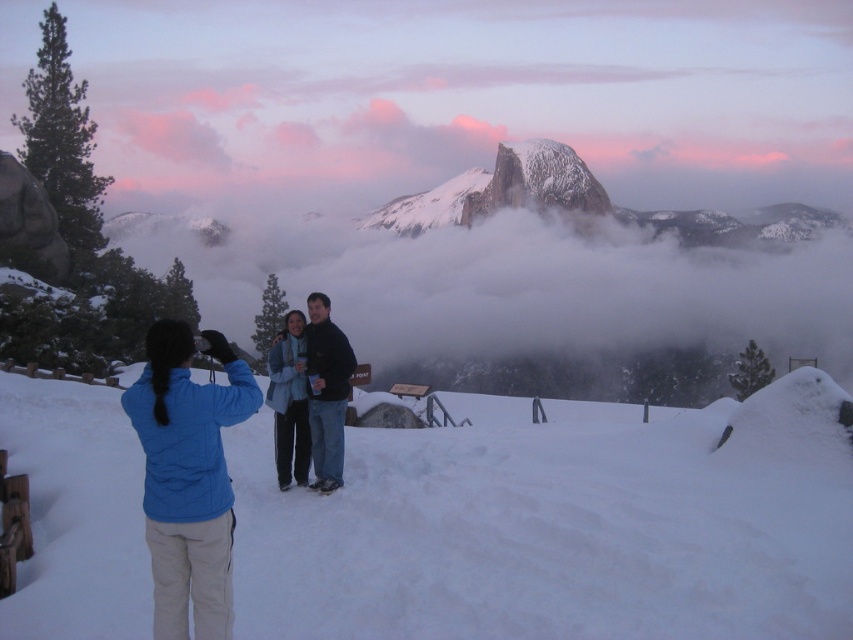
Question: Where is white snow at lower left located in relation to dark blue jacket at center in the image?

Choices:
 (A) left
 (B) right

Answer: (B)

Question: Which point appears farthest from the camera in this image?

Choices:
 (A) (531, 198)
 (B) (560, 508)
 (C) (184, 628)

Answer: (A)

Question: Which point is closer to the camera?

Choices:
 (A) (340, 333)
 (B) (56, 608)
 (C) (169, 339)
 (D) (508, 184)

Answer: (B)

Question: Can you confirm if dark blue jacket at center is positioned below snowy granite peak at center?

Choices:
 (A) yes
 (B) no

Answer: (A)

Question: Does white snow at lower left have a smaller size compared to snowy granite peak at center?

Choices:
 (A) no
 (B) yes

Answer: (A)

Question: Which of the following is the farthest from the observer?

Choices:
 (A) white snow at lower left
 (B) snowy granite peak at center
 (C) dark blue jacket at center

Answer: (B)